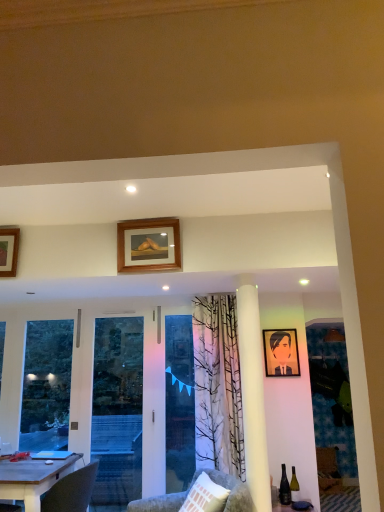
In order to face matte glass wine bottle at lower right, should I rotate leftwards or rightwards?

Rotate your view right by about 13.525°.

Measure the distance between matte glass wine bottle at lower right and camera.

matte glass wine bottle at lower right is 3.56 meters away from camera.

Describe the element at coordinates (179, 402) in the screenshot. I see `blue fabric at center` at that location.

Identify the location of transparent glass screen door at left. The image size is (384, 512). (117, 410).

Describe the element at coordinates (147, 245) in the screenshot. I see `wooden picture frame at upper center, which is the 2th picture frame in right-to-left order` at that location.

I want to click on matte glass wine bottle at lower right, so click(294, 486).

From a real-world perspective, is matte glass wine bottle at lower right located higher than blue fabric at center?

Incorrect, from a real-world perspective, matte glass wine bottle at lower right is lower than blue fabric at center.

Which object is further away from the camera taking this photo, matte glass wine bottle at lower right or blue fabric at center?

blue fabric at center is further from the camera.

Which of these two, matte glass wine bottle at lower right or blue fabric at center, is bigger?

blue fabric at center is bigger.

From a real-world perspective, is transparent glass screen door at left located higher than wooden portrait at center, acting as the 3th picture frame starting from the left?

No, from a real-world perspective, transparent glass screen door at left is not on top of wooden portrait at center, acting as the 3th picture frame starting from the left.

Is transparent glass screen door at left situated inside wooden portrait at center, the third picture frame in the front-to-back sequence, or outside?

The correct answer is: outside.

From the picture: Can you confirm if transparent glass screen door at left is wider than wooden portrait at center, positioned as the 3th picture frame in top-to-bottom order?

Indeed, transparent glass screen door at left has a greater width compared to wooden portrait at center, positioned as the 3th picture frame in top-to-bottom order.

Considering the sizes of velvet grey chair at lower center and transparent glass screen door at left in the image, is velvet grey chair at lower center wider or thinner than transparent glass screen door at left?

Considering their sizes, velvet grey chair at lower center looks broader than transparent glass screen door at left.

Is velvet grey chair at lower center bigger or smaller than transparent glass screen door at left?

Clearly, velvet grey chair at lower center is smaller in size than transparent glass screen door at left.

Between point (187, 492) and point (31, 438), which one is positioned behind?

The point (31, 438) is behind.

Choose the correct answer: Is velvet grey chair at lower center inside transparent glass screen door at left or outside it?

velvet grey chair at lower center is outside transparent glass screen door at left.

Does matte glass wine bottle at lower right lie behind wooden table at lower left?

That is True.

From a real-world perspective, who is located higher, matte glass wine bottle at lower right or wooden table at lower left?

In real-world perspective, wooden table at lower left is above.

Which is more to the left, matte glass wine bottle at lower right or wooden table at lower left?

From the viewer's perspective, wooden table at lower left appears more on the left side.

How far apart are transparent glass screen door at left and blue fabric at center?

transparent glass screen door at left and blue fabric at center are 36.44 inches apart.

Is blue fabric at center a part of transparent glass screen door at left?

That's incorrect, blue fabric at center is not inside transparent glass screen door at left.

Considering the points (62, 349) and (182, 481), which point is in front, point (62, 349) or point (182, 481)?

The point (182, 481) is closer.

From a real-world perspective, is transparent glass screen door at left beneath blue fabric at center?

Yes, from a real-world perspective, transparent glass screen door at left is under blue fabric at center.

Is point (180, 384) closer to viewer compared to point (274, 347)?

No.

You are a GUI agent. You are given a task and a screenshot of the screen. Output one action in this format:
    pyautogui.click(x=<x>, y=<y>)
    Task: Click on the picture frame behind the blue fabric at center
    Image resolution: width=384 pixels, height=512 pixels.
    Given the screenshot: What is the action you would take?
    pyautogui.click(x=281, y=352)

Based on the photo, is blue fabric at center positioned with its back to wooden portrait at center, acting as the 1th picture frame starting from the back?

No, blue fabric at center is not facing away from wooden portrait at center, acting as the 1th picture frame starting from the back.

Looking at this image, which of these two, blue fabric at center or wooden portrait at center, the third picture frame in the front-to-back sequence, is thinner?

wooden portrait at center, the third picture frame in the front-to-back sequence.

Considering the sizes of transparent glass screen door at left and matte glass wine bottle at lower right in the image, is transparent glass screen door at left bigger or smaller than matte glass wine bottle at lower right?

Clearly, transparent glass screen door at left is larger in size than matte glass wine bottle at lower right.

Does transparent glass screen door at left contain matte glass wine bottle at lower right?

No, matte glass wine bottle at lower right is not inside transparent glass screen door at left.

This screenshot has height=512, width=384. I want to click on window screen on the left of matte glass wine bottle at lower right, so click(179, 402).

From the image's perspective, which picture frame is the 1st one above the transparent glass screen door at left? Please provide its 2D coordinates.

[(281, 352)]

Based on their spatial positions, is wooden table at lower left or wooden picture frame at upper center, which ranks as the second picture frame in left-to-right order, closer to matte glass wine bottle at lower right?

The object closer to matte glass wine bottle at lower right is wooden table at lower left.

Looking at the image, which one is located closer to transparent glass screen door at left, wooden table at lower left or wooden picture frame at upper center, the 1th picture frame from the front?

wooden table at lower left.

Based on the photo, when comparing their distances from wooden table at lower left, does wooden picture frame at upper center, which is the 2th picture frame in right-to-left order, or matte glass wine bottle at lower right seem further?

Among the two, matte glass wine bottle at lower right is located further to wooden table at lower left.

Considering their positions, is wooden picture frame at upper center, marked as the first picture frame in a top-to-bottom arrangement, positioned further to matte glass wine bottle at lower right than wooden picture frame at upper left, the second picture frame viewed from the top?

The object further to matte glass wine bottle at lower right is wooden picture frame at upper left, the second picture frame viewed from the top.

Looking at the image, which one is located closer to matte glass wine bottle at lower right, blue fabric at center or wooden picture frame at upper center, which is the 2th picture frame in right-to-left order?

blue fabric at center is closer to matte glass wine bottle at lower right.

When comparing their distances from wooden table at lower left, does blue fabric at center or transparent glass screen door at left seem closer?

blue fabric at center.

When comparing their distances from blue fabric at center, does matte glass wine bottle at lower right or wooden table at lower left seem further?

wooden table at lower left is further to blue fabric at center.

From the image, which object appears to be farther from matte glass wine bottle at lower right, transparent glass screen door at left or wooden picture frame at upper center, which ranks as the second picture frame in left-to-right order?

transparent glass screen door at left lies further to matte glass wine bottle at lower right than the other object.

This screenshot has height=512, width=384. I want to click on window screen between transparent glass screen door at left and matte glass wine bottle at lower right in the horizontal direction, so click(x=179, y=402).

Where is `chair located between wooden picture frame at upper left, the 2th picture frame when ordered from front to back, and wooden portrait at center, acting as the 3th picture frame starting from the left, in the left-right direction`? chair located between wooden picture frame at upper left, the 2th picture frame when ordered from front to back, and wooden portrait at center, acting as the 3th picture frame starting from the left, in the left-right direction is located at coordinates (230, 490).

Identify the location of screen door between wooden picture frame at upper left, the second picture frame viewed from the top, and velvet grey chair at lower center, in the vertical direction. pos(117,410).

The image size is (384, 512). Identify the location of window screen between wooden picture frame at upper left, the 2th picture frame when ordered from front to back, and transparent glass screen door at left vertically. (179, 402).